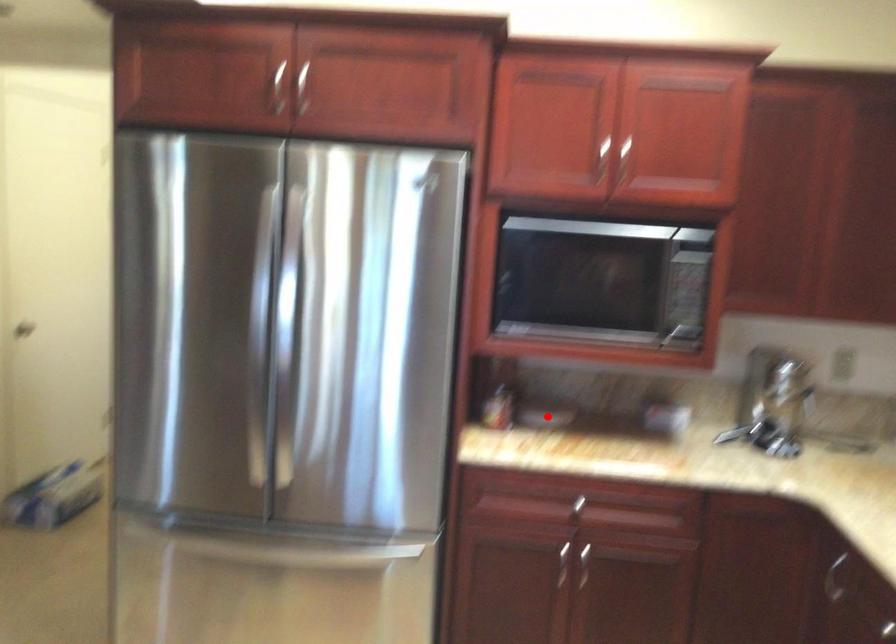
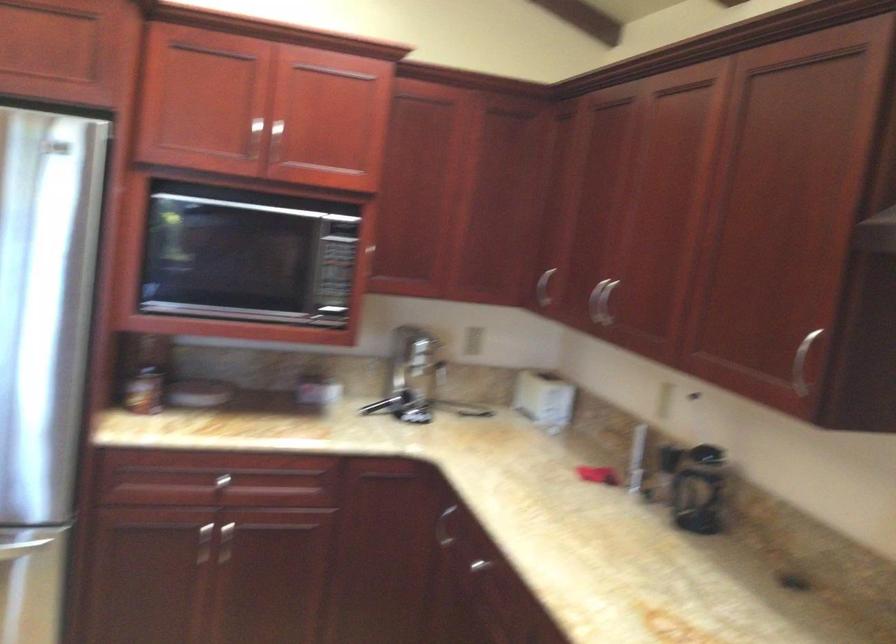
Where in the second image is the point corresponding to the highlighted location from the first image?

(197, 393)